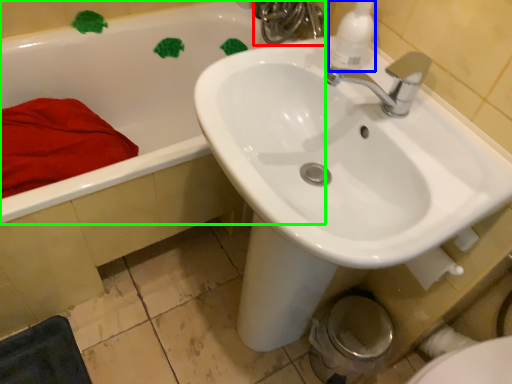
Question: Which object is positioned farthest from plumbing fixture (highlighted by a red box)? Select from soap dispenser (highlighted by a blue box) and bathtub (highlighted by a green box).

Choices:
 (A) soap dispenser
 (B) bathtub

Answer: (A)